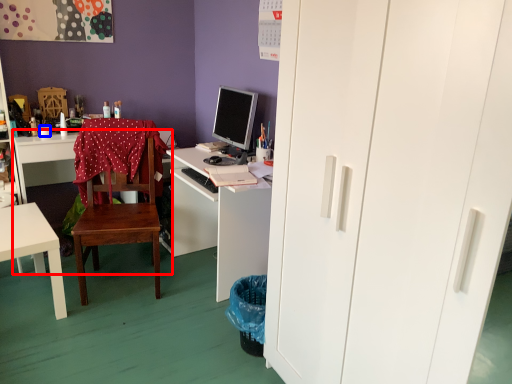
Question: Which object appears farthest to the camera in this image, desk (highlighted by a red box) or coffee cup (highlighted by a blue box)?

Choices:
 (A) desk
 (B) coffee cup

Answer: (B)